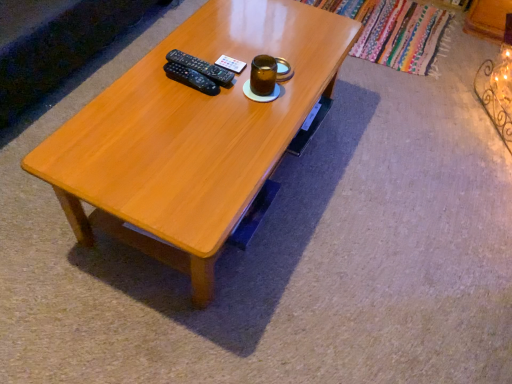
Identify the location of vacant area situated to the left side of brown glass jar at upper center. This screenshot has width=512, height=384. (200, 85).